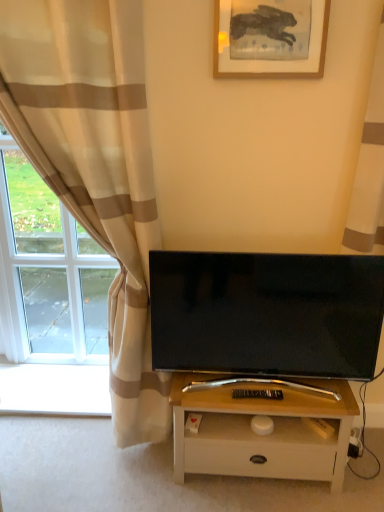
Locate an element on the screen. The height and width of the screenshot is (512, 384). free region on the left part of white wood table at center is located at coordinates (132, 473).